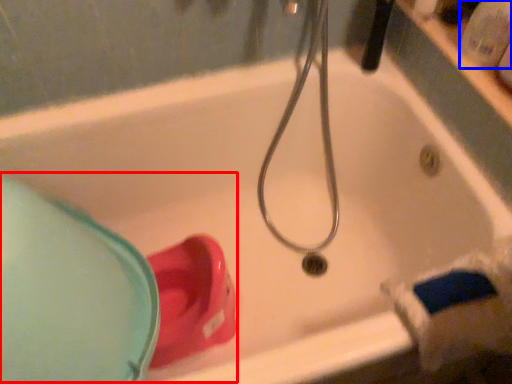
Question: Which of the following is the closest to the observer, sink (highlighted by a red box) or toiletry (highlighted by a blue box)?

Choices:
 (A) sink
 (B) toiletry

Answer: (A)